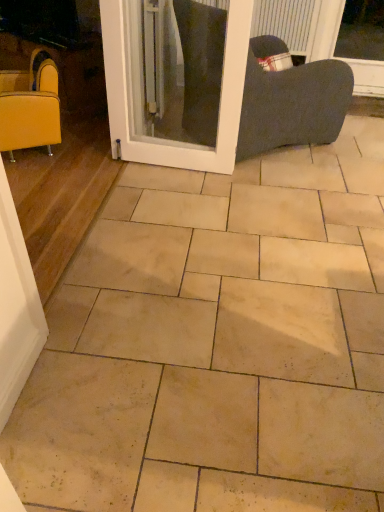
Measure the distance between point (x=125, y=145) and camera.

The depth of point (x=125, y=145) is 2.63 meters.

The width and height of the screenshot is (384, 512). Find the location of `white glossy screen door at center`. white glossy screen door at center is located at coordinates (170, 141).

Based on the photo, measure the distance between white glossy screen door at center and camera.

white glossy screen door at center is 2.02 meters from camera.

What is the approximate height of white glossy screen door at center?

white glossy screen door at center is 36.38 inches in height.

The image size is (384, 512). Describe the element at coordinates (170, 141) in the screenshot. I see `white glossy screen door at center` at that location.

What do you see at coordinates (30, 106) in the screenshot? I see `matte yellow armchair at left` at bounding box center [30, 106].

Measure the distance between point [51,63] and camera.

Point [51,63] is 8.51 feet away from camera.

At what (x,y) coordinates should I click in order to perform the action: click on matte yellow armchair at left. Please return your answer as a coordinate pair (x, y). Looking at the image, I should click on coord(30,106).

Locate an element on the screen. white glossy screen door at center is located at coordinates (170, 141).

Is matte yellow armchair at left at the right side of white glossy screen door at center?

No.

Consider the image. Is matte yellow armchair at left closer to camera compared to white glossy screen door at center?

No, matte yellow armchair at left is further to the viewer.

Which is behind, point (30, 63) or point (235, 16)?

The point (30, 63) is farther.

From the image's perspective, which is above, matte yellow armchair at left or white glossy screen door at center?

white glossy screen door at center appears higher in the image.

From a real-world perspective, is matte yellow armchair at left located higher than white glossy screen door at center?

Actually, matte yellow armchair at left is physically below white glossy screen door at center in the real world.

Which object is wider, matte yellow armchair at left or white glossy screen door at center?

With larger width is matte yellow armchair at left.

Is matte yellow armchair at left shorter than white glossy screen door at center?

Yes, matte yellow armchair at left is shorter than white glossy screen door at center.

Can you confirm if matte yellow armchair at left is smaller than white glossy screen door at center?

No, matte yellow armchair at left is not smaller than white glossy screen door at center.

Is matte yellow armchair at left surrounding white glossy screen door at center?

No, white glossy screen door at center is located outside of matte yellow armchair at left.

Can you see matte yellow armchair at left touching white glossy screen door at center?

They are not placed beside each other.

Is matte yellow armchair at left aimed at white glossy screen door at center?

No, matte yellow armchair at left is not aimed at white glossy screen door at center.

How different are the orientations of matte yellow armchair at left and white glossy screen door at center in degrees?

The angular difference between matte yellow armchair at left and white glossy screen door at center is 53.3 degrees.

Identify the location of chair on the left of the white glossy screen door at center. (30, 106).

Visually, is white glossy screen door at center positioned to the left or to the right of matte yellow armchair at left?

white glossy screen door at center is to the right of matte yellow armchair at left.

Is the position of white glossy screen door at center less distant than that of matte yellow armchair at left?

Yes, it is in front of matte yellow armchair at left.

Is point (240, 7) more distant than point (15, 147)?

No, it is not.

From the image's perspective, which object appears higher, white glossy screen door at center or matte yellow armchair at left?

white glossy screen door at center appears higher in the image.

From a real-world perspective, does white glossy screen door at center sit lower than matte yellow armchair at left?

No.

In terms of width, does white glossy screen door at center look wider or thinner when compared to matte yellow armchair at left?

Considering their sizes, white glossy screen door at center looks slimmer than matte yellow armchair at left.

Looking at this image, does white glossy screen door at center have a lesser height compared to matte yellow armchair at left?

No, white glossy screen door at center is not shorter than matte yellow armchair at left.

Does white glossy screen door at center have a larger size compared to matte yellow armchair at left?

Incorrect, white glossy screen door at center is not larger than matte yellow armchair at left.

Can we say white glossy screen door at center lies outside matte yellow armchair at left?

Absolutely, white glossy screen door at center is external to matte yellow armchair at left.

Is white glossy screen door at center not near matte yellow armchair at left?

No, white glossy screen door at center is not far away from matte yellow armchair at left.

Is white glossy screen door at center looking in the opposite direction of matte yellow armchair at left?

No, white glossy screen door at center's orientation is not away from matte yellow armchair at left.

I want to click on chair on the left of the white glossy screen door at center, so click(x=30, y=106).

The image size is (384, 512). Find the location of `screen door on the right of matte yellow armchair at left`. screen door on the right of matte yellow armchair at left is located at coordinates (170, 141).

The width and height of the screenshot is (384, 512). What are the coordinates of `screen door in front of the matte yellow armchair at left` in the screenshot? It's located at (170, 141).